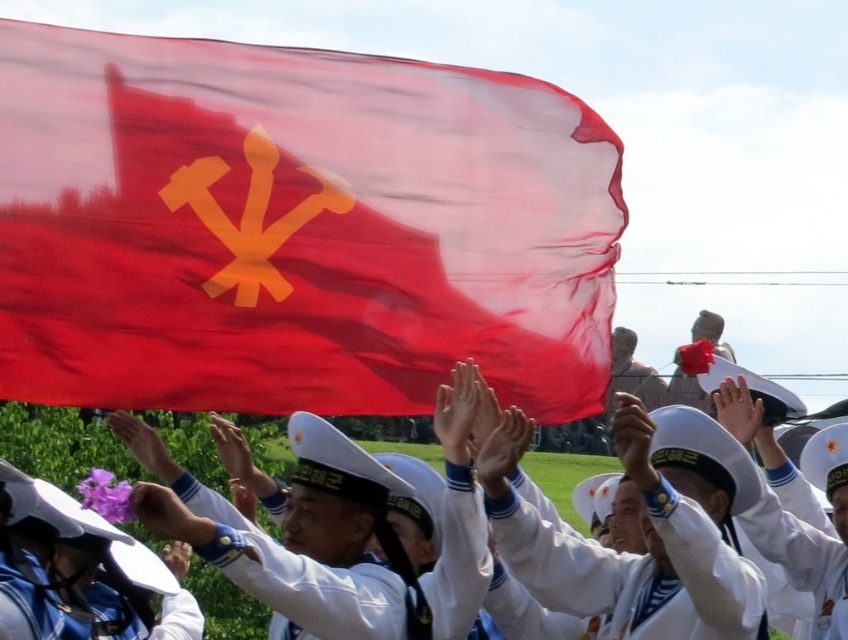
Can you confirm if white matte sailor uniform at center is thinner than white matte uniform at center?

Yes.

The height and width of the screenshot is (640, 848). I want to click on white matte sailor uniform at center, so click(x=634, y=573).

Is white matte uniform at center to the left of white cotton sailor hat at upper center from the viewer's perspective?

Indeed, white matte uniform at center is positioned on the left side of white cotton sailor hat at upper center.

Does point (422, 586) come behind point (750, 536)?

No, it is not.

The width and height of the screenshot is (848, 640). In order to click on white matte uniform at center in this screenshot , I will do `click(304, 580)`.

Can you confirm if red fabric flag at upper center is positioned below white cotton sailor hat at upper center?

Actually, red fabric flag at upper center is above white cotton sailor hat at upper center.

Can you confirm if red fabric flag at upper center is positioned to the right of white cotton sailor hat at upper center?

No, red fabric flag at upper center is not to the right of white cotton sailor hat at upper center.

Is point (210, 289) less distant than point (821, 608)?

Yes, point (210, 289) is closer to viewer.

At what (x,y) coordinates should I click in order to perform the action: click on red fabric flag at upper center. Please return your answer as a coordinate pair (x, y). The width and height of the screenshot is (848, 640). Looking at the image, I should click on (294, 228).